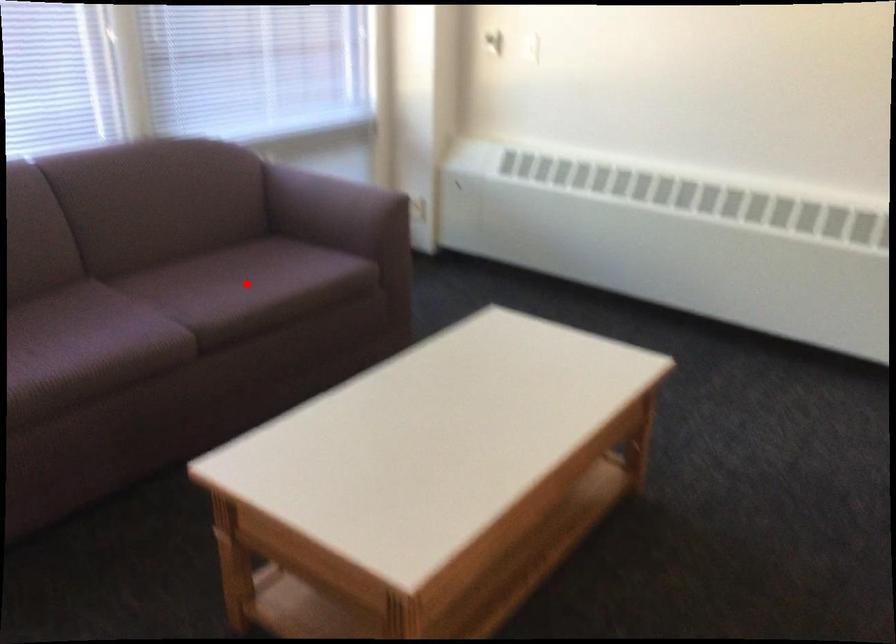
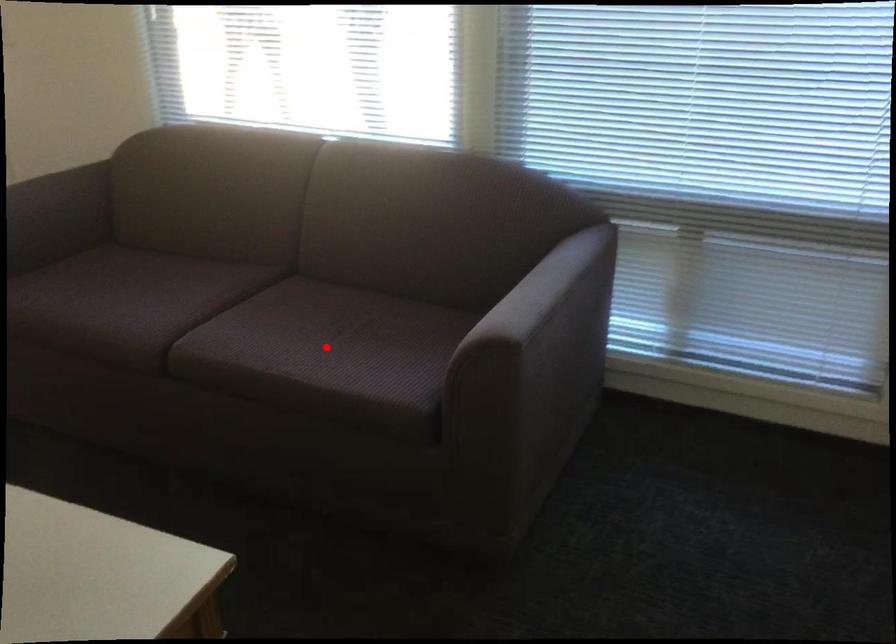
I am providing you with two images of the same scene from different viewpoints. A red point is marked on the first image and another point is marked on the second image. Does the point marked in image1 correspond to the same location as the one in image2?

Yes